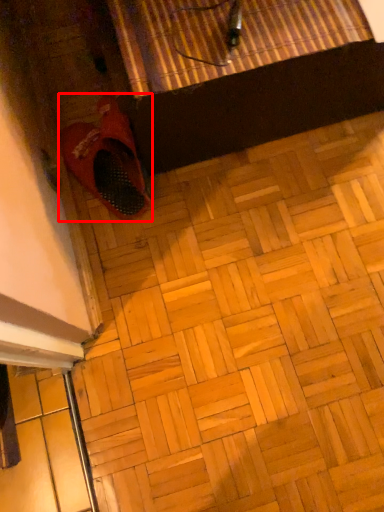
Question: Observing the image, what is the correct spatial positioning of footwear (annotated by the red box) in reference to tile?

Choices:
 (A) right
 (B) left

Answer: (B)